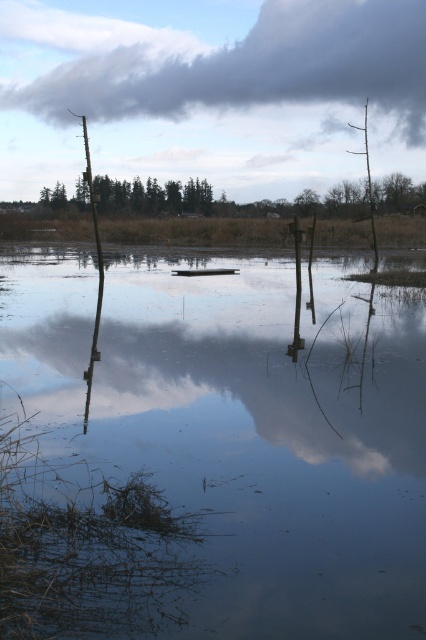
Question: Which point appears farthest from the camera in this image?

Choices:
 (A) (31, 284)
 (B) (115, 70)

Answer: (B)

Question: Is smooth reflective water at center positioned in front of cloudy gray cloud at upper center?

Choices:
 (A) yes
 (B) no

Answer: (A)

Question: Is smooth reflective water at center below cloudy gray cloud at upper center?

Choices:
 (A) yes
 (B) no

Answer: (A)

Question: Does smooth reflective water at center have a larger size compared to cloudy gray cloud at upper center?

Choices:
 (A) no
 (B) yes

Answer: (A)